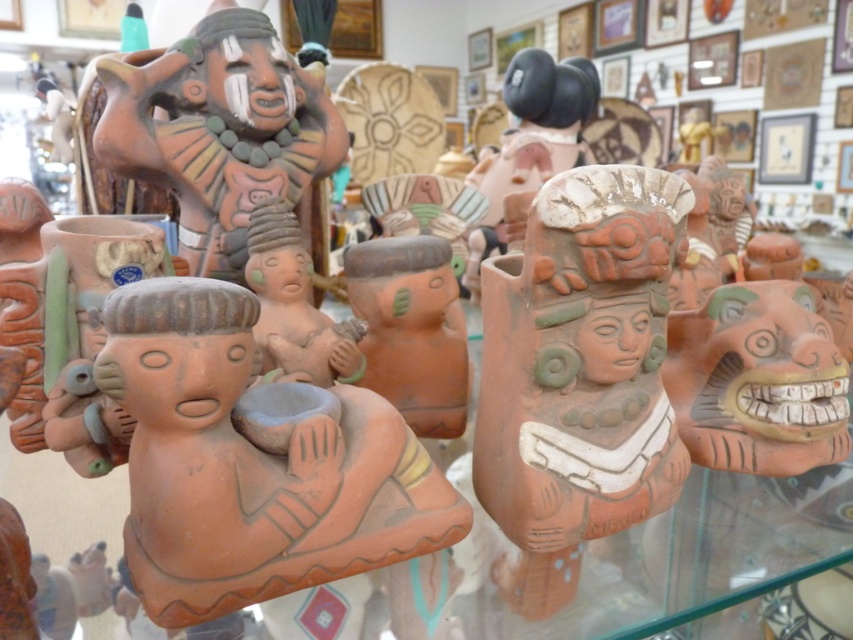
I want to click on matte clay figurine at center, so click(x=581, y=360).

Does matte clay figurine at center have a smaller size compared to terracotta clay mask at center-right?

No.

Who is more forward, (587, 365) or (834, 392)?

Point (587, 365) is more forward.

The height and width of the screenshot is (640, 853). What are the coordinates of `matte clay figurine at center` in the screenshot? It's located at (581, 360).

Is terracotta clay figure at center shorter than terracotta clay mask at center-right?

Incorrect, terracotta clay figure at center's height does not fall short of terracotta clay mask at center-right's.

Who is more forward, [154,573] or [769,305]?

Point [154,573]

The height and width of the screenshot is (640, 853). I want to click on terracotta clay figure at center, so click(x=252, y=461).

Can you confirm if terracotta clay figure at center is shorter than matte clay figurine at center?

Correct, terracotta clay figure at center is not as tall as matte clay figurine at center.

Where is `terracotta clay figure at center`? terracotta clay figure at center is located at coordinates (252, 461).

At what (x,y) coordinates should I click in order to perform the action: click on terracotta clay figure at center. Please return your answer as a coordinate pair (x, y). The height and width of the screenshot is (640, 853). Looking at the image, I should click on (252, 461).